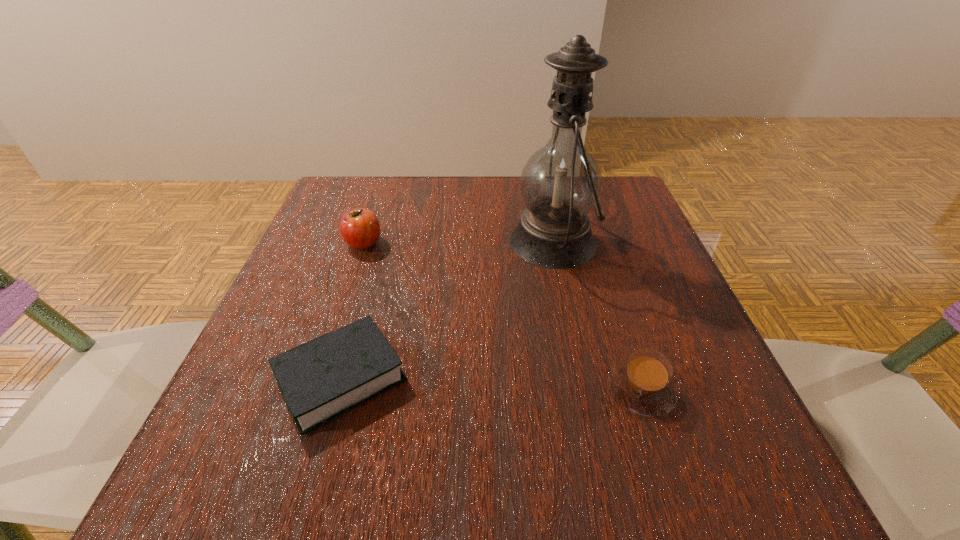
Locate an element on the screen. Image resolution: width=960 pixels, height=540 pixels. object identified as the closest to the shortest object is located at coordinates (360, 229).

Find the location of a particular element. The width and height of the screenshot is (960, 540). free location that satisfies the following two spatial constraints: 1. on the front side of the cappuccino; 2. on the left side of the apple is located at coordinates (315, 389).

The image size is (960, 540). I want to click on free space that satisfies the following two spatial constraints: 1. on the back side of the third shortest object; 2. on the left side of the tallest object, so click(x=364, y=241).

Image resolution: width=960 pixels, height=540 pixels. What are the coordinates of `vacant space that satisfies the following two spatial constraints: 1. on the front side of the third shortest object; 2. on the right side of the cappuccino` in the screenshot? It's located at (315, 389).

This screenshot has width=960, height=540. What are the coordinates of `free space in the image that satisfies the following two spatial constraints: 1. on the front side of the cappuccino; 2. on the right side of the shortest object` in the screenshot? It's located at (338, 389).

Find the location of a particular element. The width and height of the screenshot is (960, 540). vacant space that satisfies the following two spatial constraints: 1. on the front side of the third shortest object; 2. on the left side of the third tallest object is located at coordinates (315, 389).